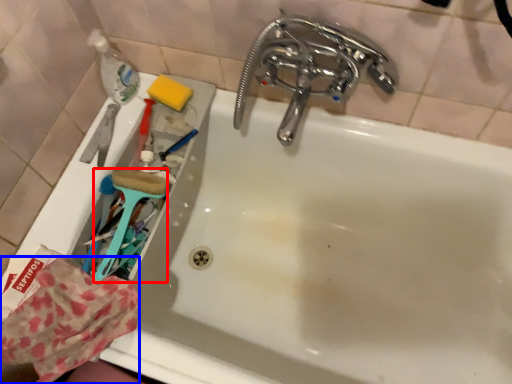
Question: Which of the following is the farthest to the observer, brush (highlighted by a red box) or material (highlighted by a blue box)?

Choices:
 (A) brush
 (B) material

Answer: (A)